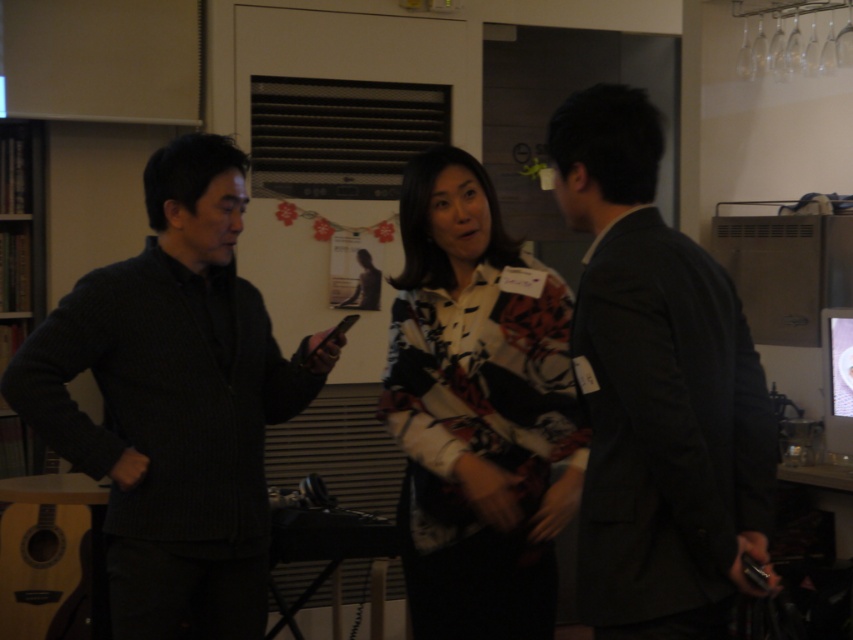
Question: Which point appears closest to the camera in this image?

Choices:
 (A) (157, 508)
 (B) (393, 433)
 (C) (769, 508)

Answer: (C)

Question: Which point is farther to the camera?

Choices:
 (A) (122, 484)
 (B) (514, 502)

Answer: (B)

Question: Does dark gray sweater at center have a larger size compared to dark gray suit at right?

Choices:
 (A) yes
 (B) no

Answer: (A)

Question: Can you confirm if dark gray sweater at center is wider than floral-patterned shirt at center?

Choices:
 (A) yes
 (B) no

Answer: (A)

Question: Which object appears closest to the camera in this image?

Choices:
 (A) dark gray sweater at center
 (B) floral-patterned shirt at center
 (C) dark gray suit at right

Answer: (C)

Question: Can you confirm if dark gray sweater at center is thinner than floral-patterned shirt at center?

Choices:
 (A) no
 (B) yes

Answer: (A)